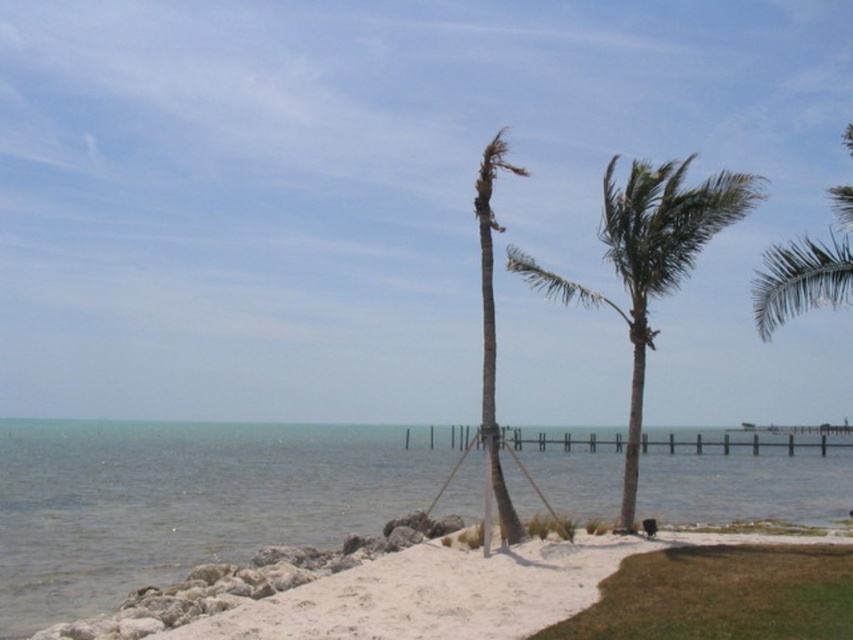
You are standing at the point with coordinates point (485, 332) and want to walk towards the wooden pier. There is an obstacle at point (166, 552). Will you be able to see the obstacle from your current position?

Point (166, 552) is behind point (485, 332), so you will not be able to see the obstacle at point (166, 552) from your current position at point (485, 332) because it is obscured by the point in front.

You are planning to build a small sandcastle on the beach. The clear water at lower left and the green textured palm tree at center are both in your view. Which area would you choose to build your sandcastle to ensure it stays dry for longer, and why?

You should build the sandcastle near the green textured palm tree at center because the clear water at lower left has a larger width, meaning it might reach closer to the shore and potentially wet the sandcastle faster.

You are standing on the beach and want to walk to the wooden pier. You see the clear water at lower left and the green leafy palm tree at upper right. Which object is closer to the ground level?

The clear water at lower left is closer to the ground level since it has a lesser height compared to the green leafy palm tree at upper right.